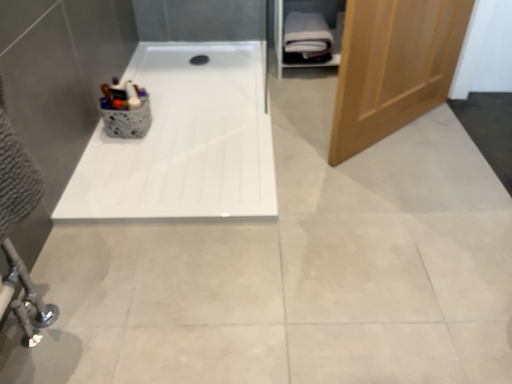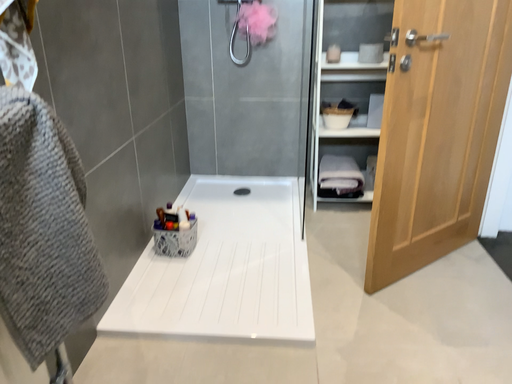
Question: Which way did the camera rotate in the video?

Choices:
 (A) rotated upward
 (B) rotated downward

Answer: (A)